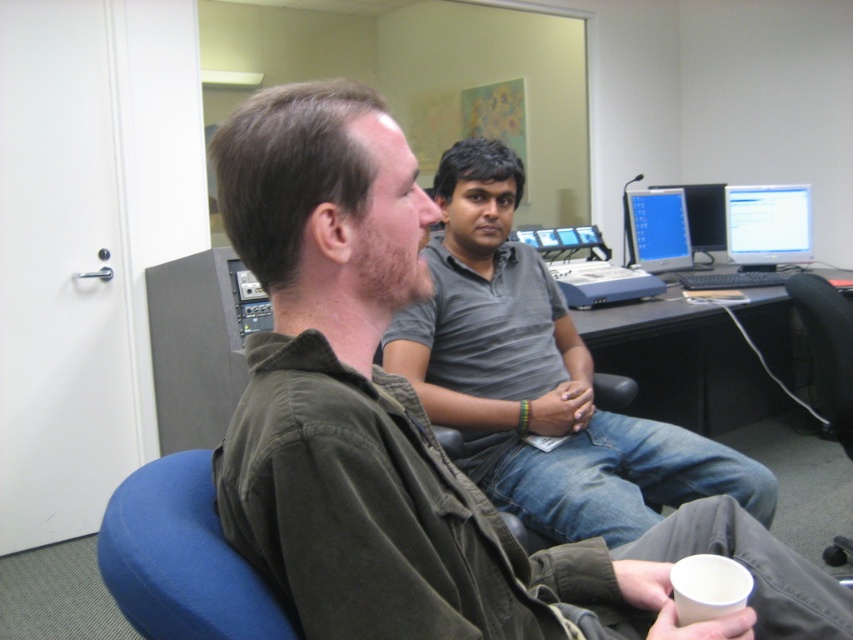
You are a delivery person standing at the camera position. You need to place a package at point (265, 560). The package is 24 inches long. Will the package fit if placed horizontally from the camera to that point?

The point (265, 560) is 25.39 inches from the camera. Since the package is 24 inches long, it will fit horizontally as 24 inches is shorter than 25.39 inches.

You are navigating through an office space and need to reach a file located at point (219, 628). There is an obstacle at point (531, 484) blocking your path. Can you safely walk around the obstacle to reach the file?

Point (531, 484) is further to the viewer than point (219, 628), so you can safely walk around the obstacle at point (531, 484) to reach the file at point (219, 628).

You are an office worker who needs to sit down at the desk. There is a blue fabric swivel chair at left and a matte black monitor at center. Which object should you approach first to sit in the chair?

You should approach the blue fabric swivel chair at left first because it is located to the left of the matte black monitor at center, making it the closest to your current position if you are facing the desk.